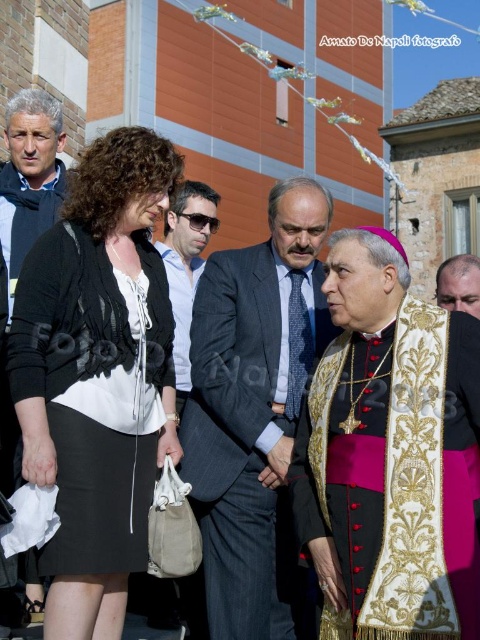
You are standing at point (372, 552) and want to walk to point (141, 180). Is the point you want to reach in front of or behind you?

The point (141, 180) is behind point (372, 552), so the destination is behind you.

You are a fashion designer observing the matte black sweater at left and the light brown leather jacket at center in the image. Which item of clothing appears to be smaller in size?

The matte black sweater at left is smaller than the light brown leather jacket at center.

You are organizing a photo shoot and need to arrange two participants wearing a matte black sweater at left and a light brown leather jacket at center. Based on the scene description, which clothing item is located to the left of the other?

The matte black sweater at left is positioned on the left side of the light brown leather jacket at center.